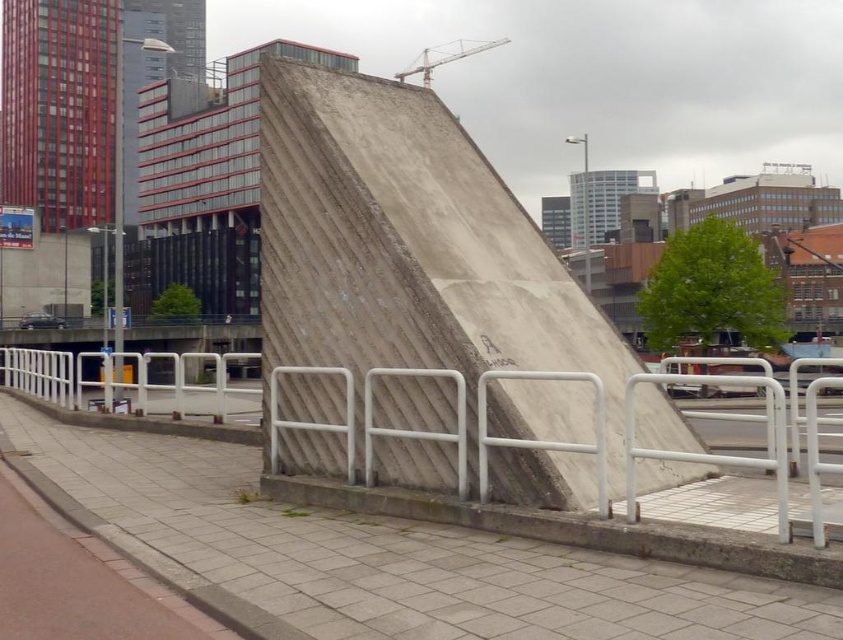
In the scene shown: Is concrete textured ramp at center wider than concrete rough at center?

No.

Does concrete textured ramp at center appear on the right side of concrete rough at center?

Correct, you'll find concrete textured ramp at center to the right of concrete rough at center.

Is point (414, 401) in front of point (627, 596)?

No, it is not.

Image resolution: width=843 pixels, height=640 pixels. What are the coordinates of `concrete textured ramp at center` in the screenshot? It's located at (411, 248).